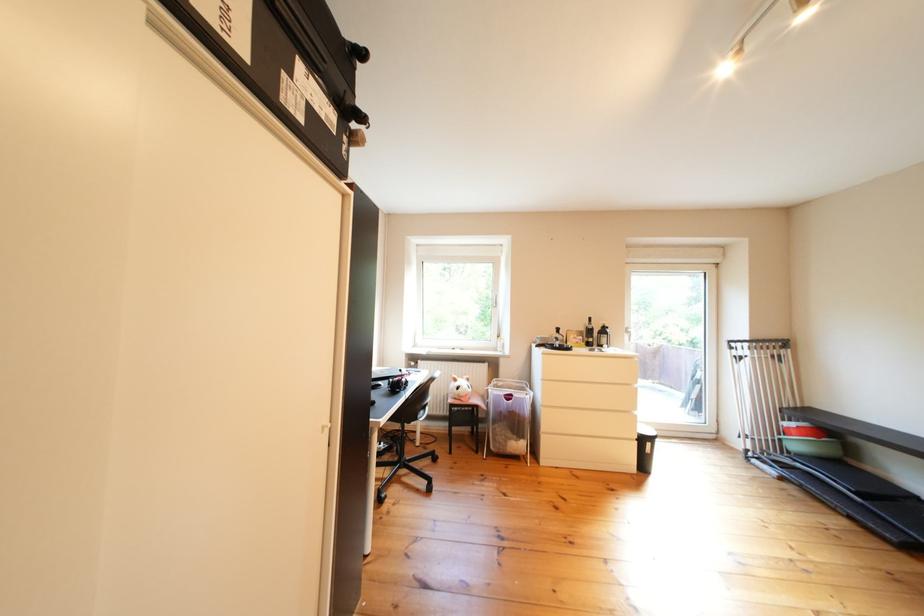
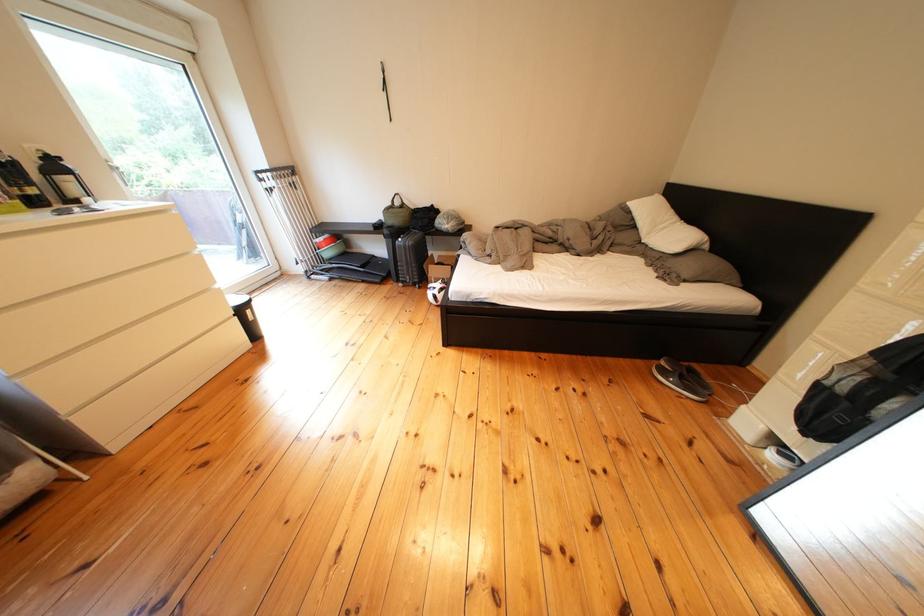
Find the pixel in the second image that matches (659,435) in the first image.

(250, 304)